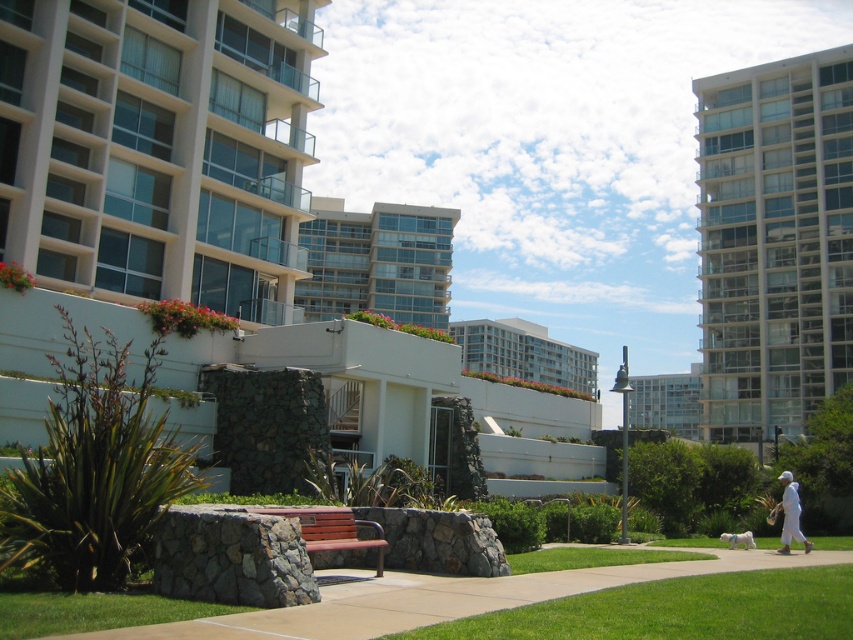
This screenshot has width=853, height=640. Describe the element at coordinates (677, 611) in the screenshot. I see `green grass at lower center` at that location.

The width and height of the screenshot is (853, 640). Describe the element at coordinates (677, 611) in the screenshot. I see `green grass at lower center` at that location.

I want to click on green grass at lower center, so click(677, 611).

Who is higher up, white glass building at upper right or white glass building at center?

white glass building at upper right is above.

In the scene shown: Is white glass building at upper right smaller than white glass building at center?

Yes, white glass building at upper right is smaller than white glass building at center.

Describe the element at coordinates (775, 243) in the screenshot. I see `white glass building at upper right` at that location.

Identify the location of white glass building at upper right. coord(775,243).

Is concrete pavement at center positioned before brown wooden bench at center?

Yes, concrete pavement at center is in front of brown wooden bench at center.

Which is below, concrete pavement at center or brown wooden bench at center?

Positioned lower is concrete pavement at center.

Is point (57, 600) behind point (260, 512)?

No, (57, 600) is in front of (260, 512).

The height and width of the screenshot is (640, 853). In order to click on concrete pavement at center in this screenshot , I will do `click(334, 600)`.